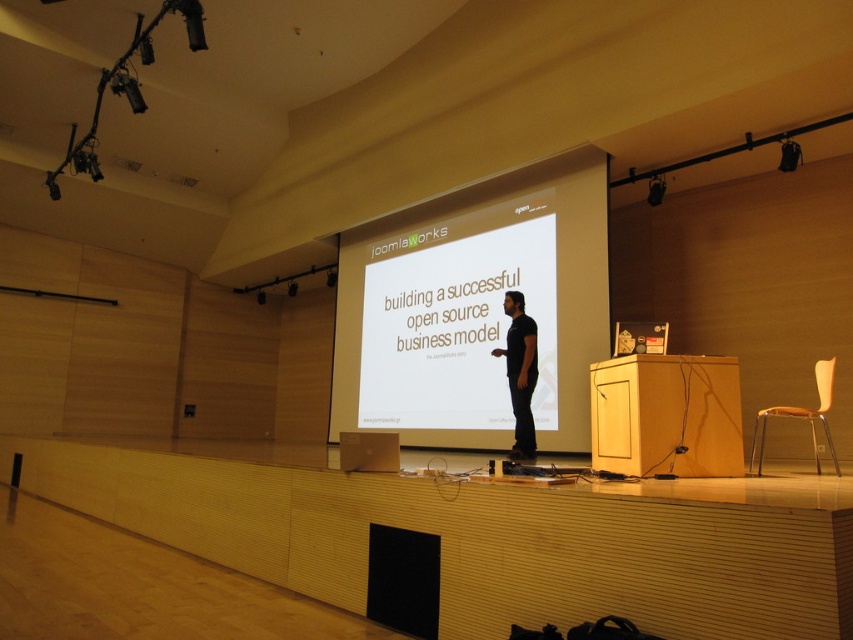
Question: Does white matte projection screen at center have a smaller size compared to dark brown leather jacket at center?

Choices:
 (A) yes
 (B) no

Answer: (B)

Question: Does white matte projection screen at center have a greater width compared to dark brown leather jacket at center?

Choices:
 (A) yes
 (B) no

Answer: (A)

Question: Is white matte projection screen at center in front of dark brown leather jacket at center?

Choices:
 (A) no
 (B) yes

Answer: (A)

Question: Which point is closer to the camera?

Choices:
 (A) (440, 205)
 (B) (511, 336)

Answer: (B)

Question: Among these objects, which one is farthest from the camera?

Choices:
 (A) dark brown leather jacket at center
 (B) white matte projection screen at center

Answer: (B)